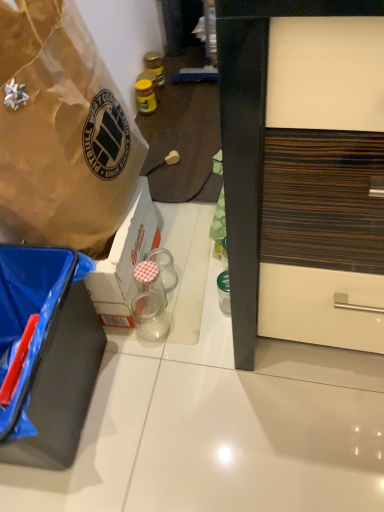
Question: Can you confirm if black matte box at lower left, arranged as the 2th box when viewed from the top, is positioned to the right of transparent glass jar at center, which is the first coffee cup in bottom-to-top order?

Choices:
 (A) no
 (B) yes

Answer: (A)

Question: Is black matte box at lower left, arranged as the 2th box when viewed from the top, at the left side of transparent glass jar at center, which is the first coffee cup in bottom-to-top order?

Choices:
 (A) no
 (B) yes

Answer: (B)

Question: Can you confirm if black matte box at lower left, the first box in the bottom-to-top sequence, is bigger than transparent glass jar at center, which is counted as the 2th coffee cup, starting from the top?

Choices:
 (A) no
 (B) yes

Answer: (B)

Question: From the image's perspective, is black matte box at lower left, the first box in the bottom-to-top sequence, over transparent glass jar at center, which is the first coffee cup in bottom-to-top order?

Choices:
 (A) yes
 (B) no

Answer: (B)

Question: Can you confirm if black matte box at lower left, the first box in the bottom-to-top sequence, is thinner than transparent glass jar at center, which is the first coffee cup in bottom-to-top order?

Choices:
 (A) yes
 (B) no

Answer: (B)

Question: Is clear glass jar at center, which is the second coffee cup from bottom to top, taller or shorter than yellow glass jar at upper center, which ranks as the second bottle in bottom-to-top order?

Choices:
 (A) tall
 (B) short

Answer: (A)

Question: From the image's perspective, is clear glass jar at center, which is the second coffee cup from bottom to top, positioned above or below yellow glass jar at upper center, which ranks as the second bottle in bottom-to-top order?

Choices:
 (A) above
 (B) below

Answer: (B)

Question: Considering the positions of point (167, 258) and point (137, 83), is point (167, 258) closer or farther from the camera than point (137, 83)?

Choices:
 (A) farther
 (B) closer

Answer: (B)

Question: Is clear glass jar at center, arranged as the first coffee cup when viewed from the top, wider or thinner than yellow glass jar at upper center, the second bottle in the back-to-front sequence?

Choices:
 (A) wide
 (B) thin

Answer: (A)

Question: From a real-world perspective, is brown paper bag at upper left, the 2th box positioned from the bottom, positioned above or below matte plastic power outlet at center?

Choices:
 (A) above
 (B) below

Answer: (A)

Question: Is brown paper bag at upper left, which appears as the 1th box when viewed from the top, in front of or behind matte plastic power outlet at center in the image?

Choices:
 (A) behind
 (B) front

Answer: (B)

Question: From the image's perspective, is brown paper bag at upper left, the 2th box positioned from the bottom, above or below matte plastic power outlet at center?

Choices:
 (A) above
 (B) below

Answer: (B)

Question: In terms of width, does brown paper bag at upper left, the 2th box positioned from the bottom, look wider or thinner when compared to matte plastic power outlet at center?

Choices:
 (A) thin
 (B) wide

Answer: (B)

Question: Do you think clear glass jar at center, which is the second coffee cup from bottom to top, is within transparent glass jar at center, which is counted as the 2th coffee cup, starting from the top, or outside of it?

Choices:
 (A) outside
 (B) inside

Answer: (A)

Question: Does point (165, 266) appear closer or farther from the camera than point (150, 312)?

Choices:
 (A) farther
 (B) closer

Answer: (A)